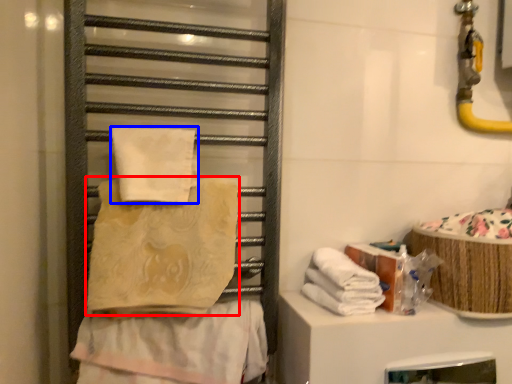
Question: Which point is closer to the camera, towel (highlighted by a red box) or towel (highlighted by a blue box)?

Choices:
 (A) towel
 (B) towel

Answer: (A)